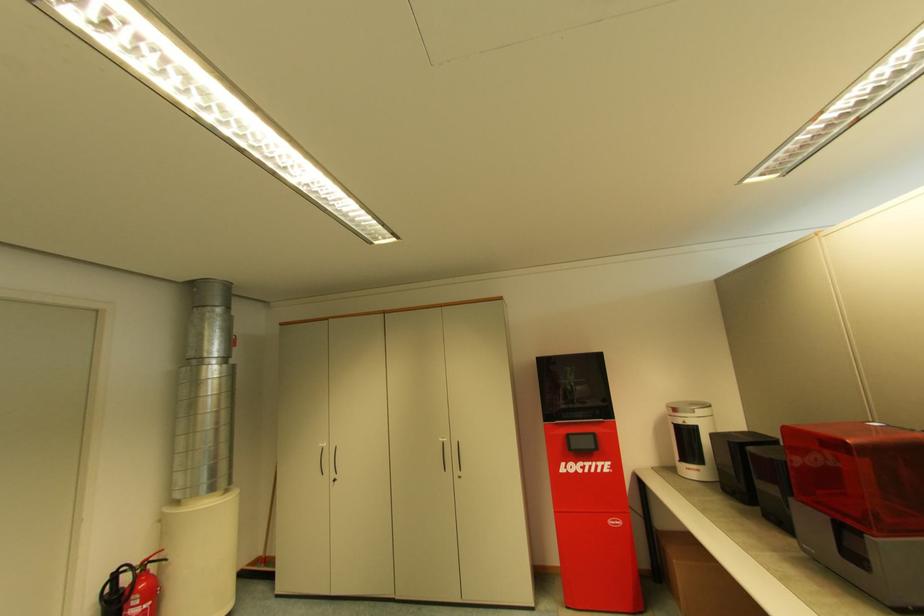
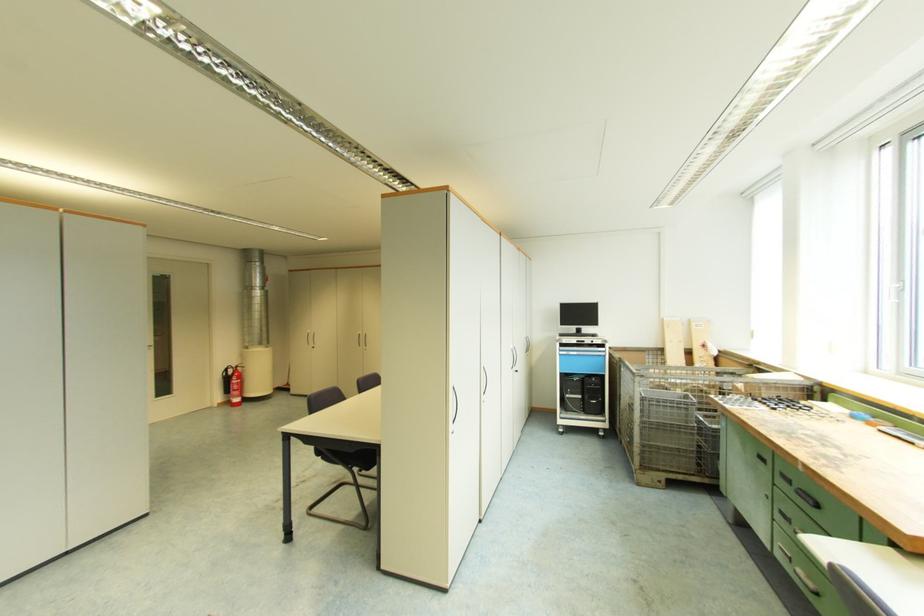
In a continuous first-person perspective shot, in which direction is the camera moving?

The cameraman walked toward right, backward.